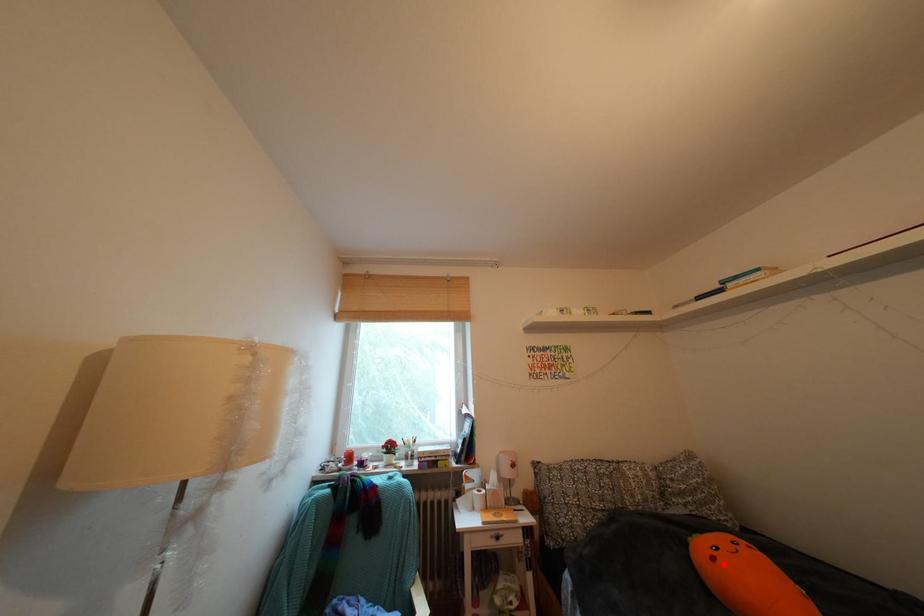
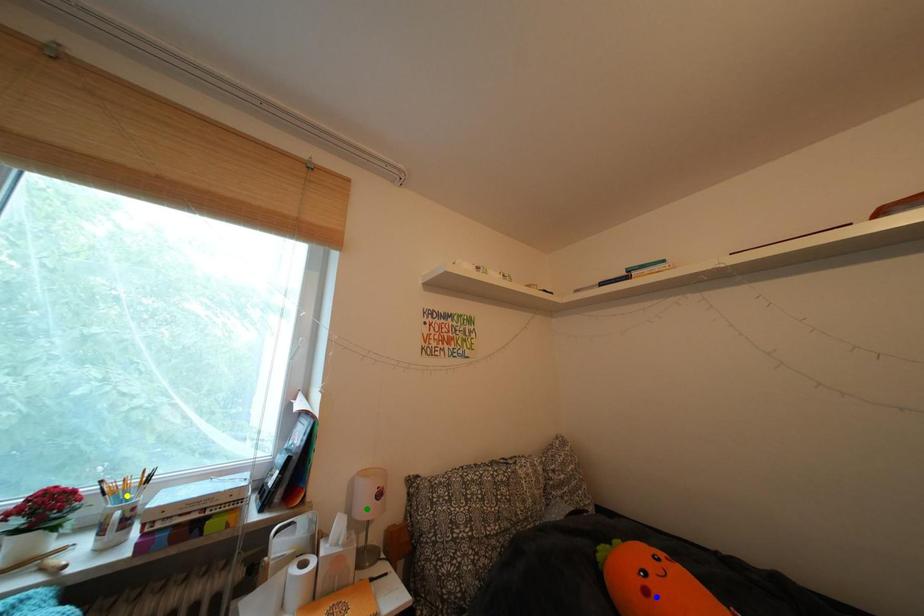
Question: I am providing you with two images of the same scene from different viewpoints. A red point is marked on the first image. You are given multiple points on the second image. Which spot in image 2 lines up with the point in image 1?

Choices:
 (A) yellow point
 (B) blue point
 (C) green point

Answer: (B)